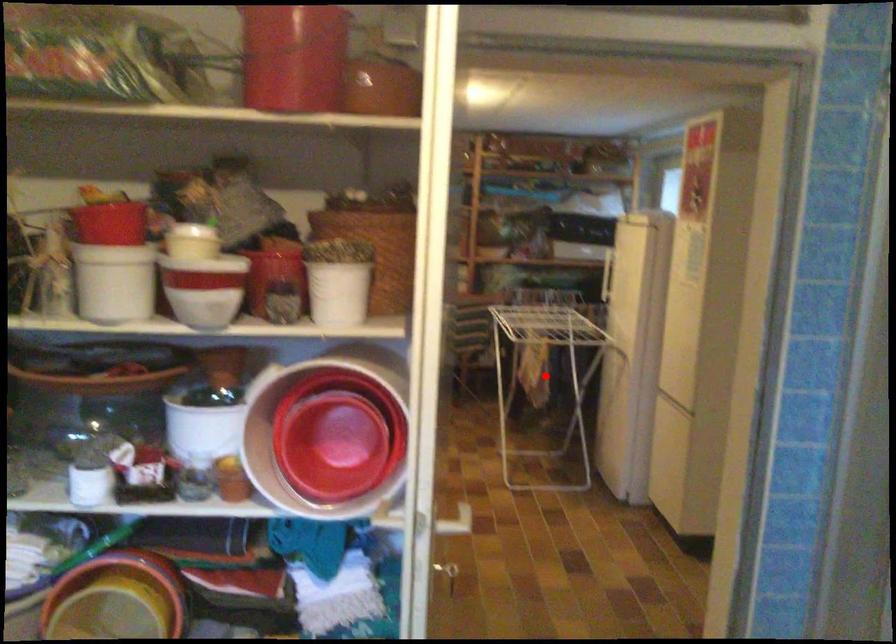
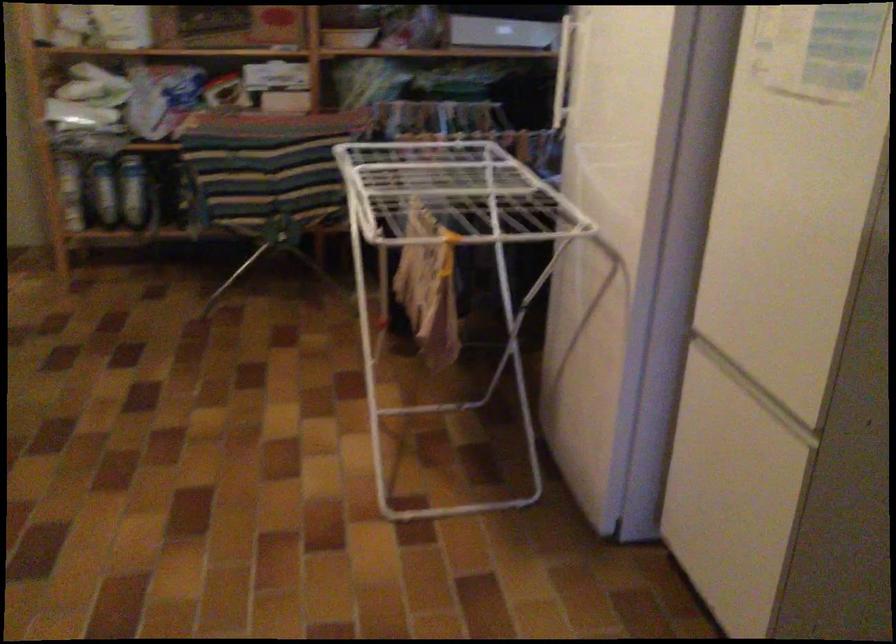
Question: I am providing you with two images of the same scene from different viewpoints. A red point is marked on the first image. Is the red point's position out of view in image 2?

Choices:
 (A) Yes
 (B) No

Answer: (A)